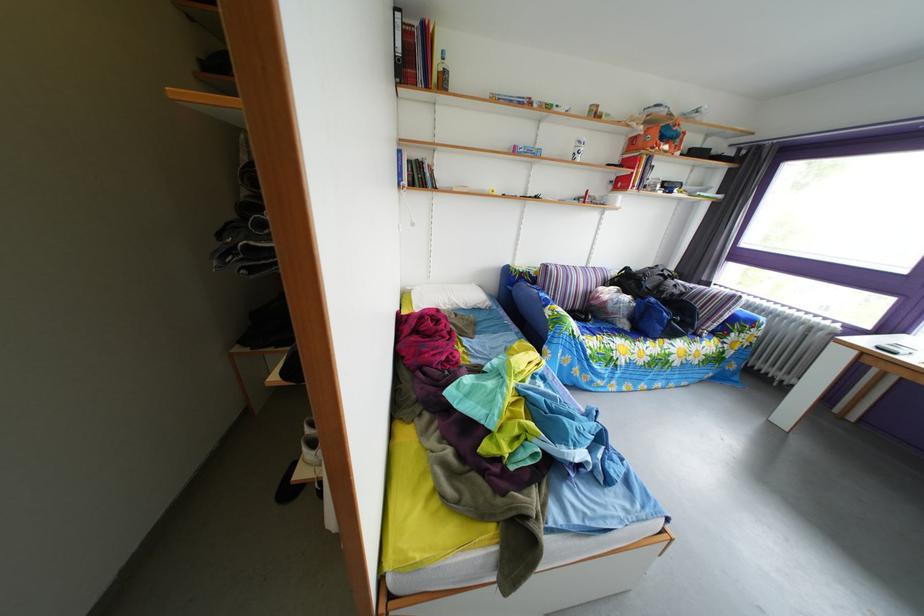
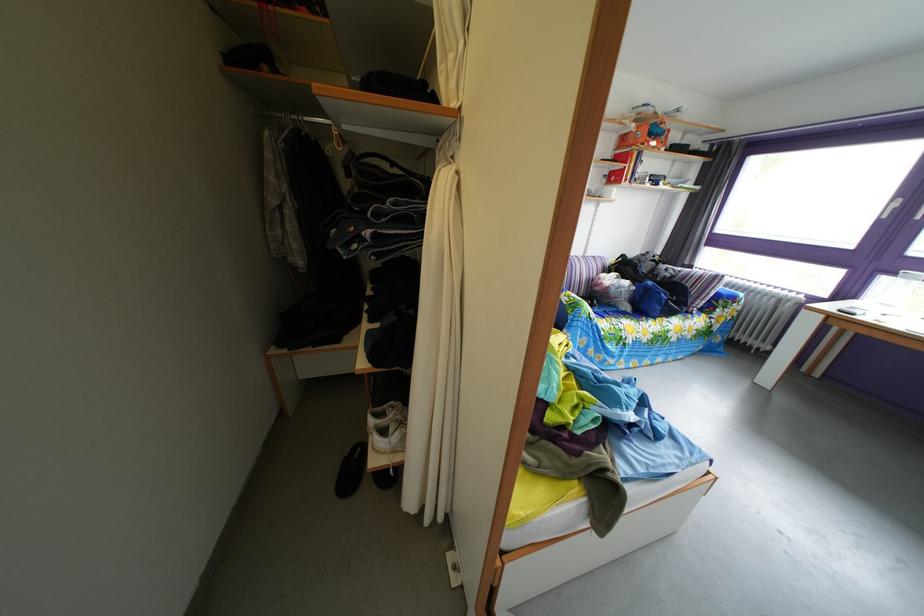
The point at (x=673, y=147) is marked in the first image. Where is the corresponding point in the second image?

(661, 144)